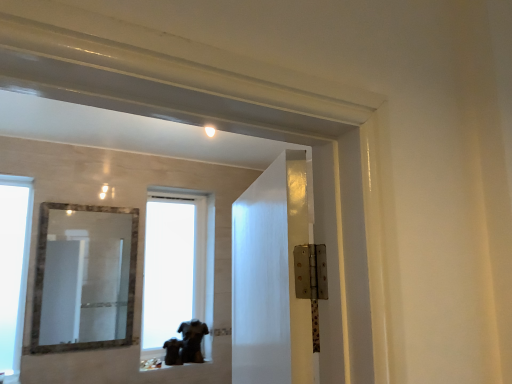
From the picture: Measure the distance between marble-framed mirror at center and camera.

The depth of marble-framed mirror at center is 14.49 feet.

Measure the distance between point (7, 326) and camera.

A distance of 2.78 meters exists between point (7, 326) and camera.

The width and height of the screenshot is (512, 384). I want to click on transparent glass window at left, acting as the 2th window starting from the back, so click(13, 266).

Image resolution: width=512 pixels, height=384 pixels. I want to click on velvety black shirt at lower center, so click(186, 344).

Which of these two, velvety black shirt at lower center or marble-framed mirror at center, stands taller?

With more height is marble-framed mirror at center.

Considering the sizes of velvety black shirt at lower center and marble-framed mirror at center in the image, is velvety black shirt at lower center bigger or smaller than marble-framed mirror at center?

velvety black shirt at lower center is smaller than marble-framed mirror at center.

Considering the sizes of objects velvety black shirt at lower center and marble-framed mirror at center in the image provided, who is thinner, velvety black shirt at lower center or marble-framed mirror at center?

With smaller width is marble-framed mirror at center.

From the image's perspective, relative to transparent glass window at center, which is the 1th window from right to left, is marble-framed mirror at center above or below?

marble-framed mirror at center is above transparent glass window at center, which is the 1th window from right to left.

From a real-world perspective, who is located higher, marble-framed mirror at center or transparent glass window at center, the 2th window from the front?

transparent glass window at center, the 2th window from the front.

Is marble-framed mirror at center bigger than transparent glass window at center, the 2th window from the front?

Actually, marble-framed mirror at center might be smaller than transparent glass window at center, the 2th window from the front.

Is marble-framed mirror at center facing away from transparent glass window at center, the 1th window when ordered from back to front?

No, marble-framed mirror at center is not facing the opposite direction of transparent glass window at center, the 1th window when ordered from back to front.

Which of these two, transparent glass window at left, acting as the 2th window starting from the back, or transparent glass window at center, placed as the 2th window when sorted from left to right, stands shorter?

transparent glass window at center, placed as the 2th window when sorted from left to right, is shorter.

Is transparent glass window at center, the 2th window from the front, at the back of transparent glass window at left, which appears as the first window when viewed from the front?

No, transparent glass window at center, the 2th window from the front, is not at the back of transparent glass window at left, which appears as the first window when viewed from the front.

Can we say transparent glass window at left, placed as the second window when sorted from right to left, lies outside transparent glass window at center, which is the 1th window from right to left?

transparent glass window at left, placed as the second window when sorted from right to left, lies outside transparent glass window at center, which is the 1th window from right to left,'s area.

Between transparent glass window at left, placed as the second window when sorted from right to left, and transparent glass window at center, placed as the 2th window when sorted from left to right, which one has larger size?

transparent glass window at center, placed as the 2th window when sorted from left to right, is bigger.

Based on the photo, from the image's perspective, would you say marble-framed mirror at center is positioned over velvety black shirt at lower center?

Indeed, from the image's perspective, marble-framed mirror at center is shown above velvety black shirt at lower center.

Is point (92, 236) less distant than point (195, 358)?

No, (92, 236) is further to viewer.

Is marble-framed mirror at center at the right side of velvety black shirt at lower center?

No, marble-framed mirror at center is not to the right of velvety black shirt at lower center.

The image size is (512, 384). Find the location of `animal on the right of marble-framed mirror at center`. animal on the right of marble-framed mirror at center is located at coordinates (186, 344).

From the picture: Is the surface of transparent glass window at center, which is the 1th window from right to left, in direct contact with transparent glass window at left, acting as the 2th window starting from the back?

No, transparent glass window at center, which is the 1th window from right to left, is not beside transparent glass window at left, acting as the 2th window starting from the back.

What's the angular difference between transparent glass window at center, the 1th window when ordered from back to front, and transparent glass window at left, placed as the 1th window when sorted from left to right,'s facing directions?

The angle between the facing direction of transparent glass window at center, the 1th window when ordered from back to front, and the facing direction of transparent glass window at left, placed as the 1th window when sorted from left to right, is 0.175 degrees.

Can you confirm if transparent glass window at center, placed as the 2th window when sorted from left to right, is shorter than transparent glass window at left, acting as the 2th window starting from the back?

Indeed, transparent glass window at center, placed as the 2th window when sorted from left to right, has a lesser height compared to transparent glass window at left, acting as the 2th window starting from the back.

Based on the photo, from the image's perspective, is transparent glass window at center, which is the 1th window from right to left, over transparent glass window at left, which appears as the first window when viewed from the front?

No.

Is transparent glass window at center, the 2th window from the front, far away from marble-framed mirror at center?

transparent glass window at center, the 2th window from the front, is actually quite close to marble-framed mirror at center.

Between point (185, 320) and point (111, 235), which one is positioned behind?

The point (185, 320) is farther.

From the image's perspective, between transparent glass window at center, the 1th window when ordered from back to front, and marble-framed mirror at center, which one is located above?

marble-framed mirror at center appears higher in the image.

Which of these two, velvety black shirt at lower center or transparent glass window at center, which is the 1th window from right to left, stands taller?

transparent glass window at center, which is the 1th window from right to left, is taller.

Is velvety black shirt at lower center bigger than transparent glass window at center, placed as the 2th window when sorted from left to right?

No, velvety black shirt at lower center is not bigger than transparent glass window at center, placed as the 2th window when sorted from left to right.

Is velvety black shirt at lower center to the left of transparent glass window at center, which is the 1th window from right to left, from the viewer's perspective?

No, velvety black shirt at lower center is not to the left of transparent glass window at center, which is the 1th window from right to left.

Is velvety black shirt at lower center not within transparent glass window at center, the 1th window when ordered from back to front?

Yes, velvety black shirt at lower center is not within transparent glass window at center, the 1th window when ordered from back to front.

In the image, there is a velvety black shirt at lower center. Where is `mirror above it (from the image's perspective)`? The image size is (512, 384). mirror above it (from the image's perspective) is located at coordinates (86, 277).

This screenshot has width=512, height=384. Identify the location of mirror on the left of transparent glass window at center, the 2th window from the front. (86, 277).

In the scene shown: From the image, which object appears to be farther from transparent glass window at center, the 2th window from the front, velvety black shirt at lower center or transparent glass window at left, acting as the 2th window starting from the back?

transparent glass window at left, acting as the 2th window starting from the back, lies further to transparent glass window at center, the 2th window from the front, than the other object.

When comparing their distances from transparent glass window at center, the 2th window from the front, does transparent glass window at left, placed as the second window when sorted from right to left, or marble-framed mirror at center seem closer?

The object closer to transparent glass window at center, the 2th window from the front, is marble-framed mirror at center.

Looking at the image, which one is located closer to velvety black shirt at lower center, transparent glass window at left, which appears as the first window when viewed from the front, or marble-framed mirror at center?

Among the two, transparent glass window at left, which appears as the first window when viewed from the front, is located nearer to velvety black shirt at lower center.

Which object lies nearer to the anchor point velvety black shirt at lower center, transparent glass window at left, placed as the second window when sorted from right to left, or transparent glass window at center, the 2th window from the front?

transparent glass window at left, placed as the second window when sorted from right to left, is positioned closer to the anchor velvety black shirt at lower center.

When comparing their distances from transparent glass window at left, placed as the 1th window when sorted from left to right, does velvety black shirt at lower center or transparent glass window at center, which is the 1th window from right to left, seem closer?

Based on the image, velvety black shirt at lower center appears to be nearer to transparent glass window at left, placed as the 1th window when sorted from left to right.

When comparing their distances from velvety black shirt at lower center, does marble-framed mirror at center or transparent glass window at left, acting as the 2th window starting from the back, seem further?

Based on the image, marble-framed mirror at center appears to be further to velvety black shirt at lower center.

Estimate the real-world distances between objects in this image. Which object is closer to marble-framed mirror at center, velvety black shirt at lower center or transparent glass window at center, the 2th window from the front?

transparent glass window at center, the 2th window from the front, is closer to marble-framed mirror at center.

Based on their spatial positions, is transparent glass window at center, the 1th window when ordered from back to front, or transparent glass window at left, placed as the second window when sorted from right to left, closer to marble-framed mirror at center?

transparent glass window at center, the 1th window when ordered from back to front, is closer to marble-framed mirror at center.

Locate an element on the screen. window between transparent glass window at left, which appears as the first window when viewed from the front, and velvety black shirt at lower center from left to right is located at coordinates (175, 265).

Where is `mirror located between transparent glass window at left, placed as the 1th window when sorted from left to right, and velvety black shirt at lower center in the left-right direction`? This screenshot has height=384, width=512. mirror located between transparent glass window at left, placed as the 1th window when sorted from left to right, and velvety black shirt at lower center in the left-right direction is located at coordinates (86, 277).

The width and height of the screenshot is (512, 384). In order to click on mirror located between transparent glass window at left, acting as the 2th window starting from the back, and transparent glass window at center, the 2th window from the front, in the left-right direction in this screenshot , I will do [86, 277].